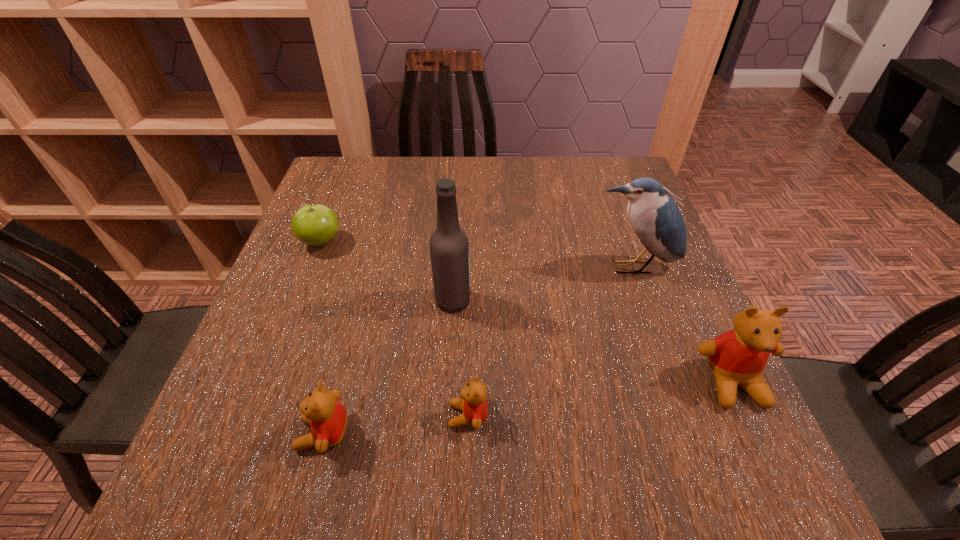
Where is `vacant space situated 0.080m on the front-facing side of the leftmost teddy bear`? This screenshot has height=540, width=960. vacant space situated 0.080m on the front-facing side of the leftmost teddy bear is located at coordinates (250, 434).

Where is `free region located 0.110m on the front-facing side of the shortest object`? free region located 0.110m on the front-facing side of the shortest object is located at coordinates (383, 416).

This screenshot has width=960, height=540. I want to click on blank space located 0.140m on the front-facing side of the shortest object, so click(366, 416).

Find the location of a particular element. The width and height of the screenshot is (960, 540). free location located on the front-facing side of the shortest object is located at coordinates (289, 416).

The height and width of the screenshot is (540, 960). Identify the location of vacant space positioned at the tip of the bird's beak. (689, 426).

I want to click on blank area located 0.060m on the side of the beer bottle with the label, so click(499, 301).

This screenshot has height=540, width=960. Identify the location of free space located on the right of the apple. (492, 242).

The image size is (960, 540). I want to click on teddy bear located in the left edge section of the desktop, so click(327, 417).

The image size is (960, 540). I want to click on apple that is positioned at the left edge, so click(316, 225).

I want to click on teddy bear at the right edge, so click(x=738, y=357).